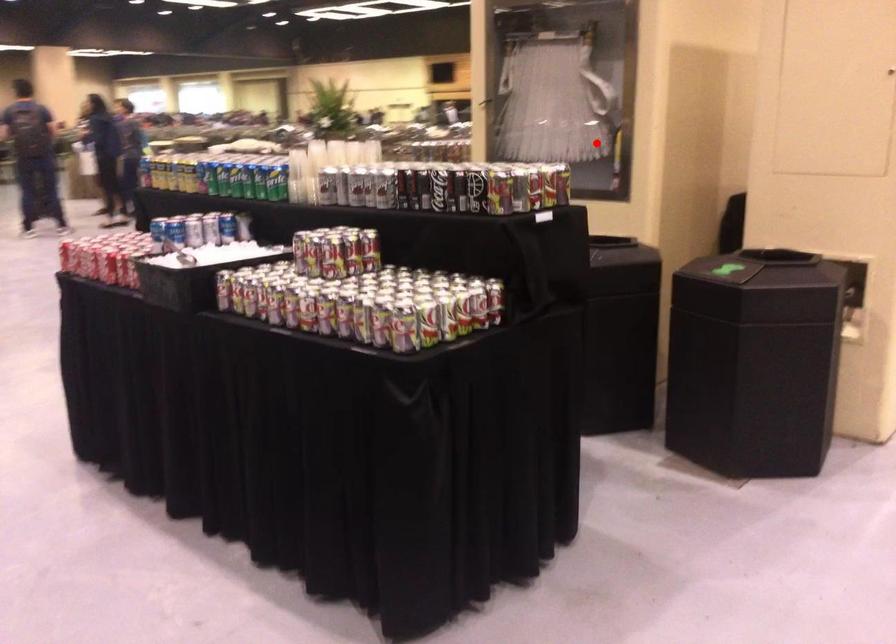
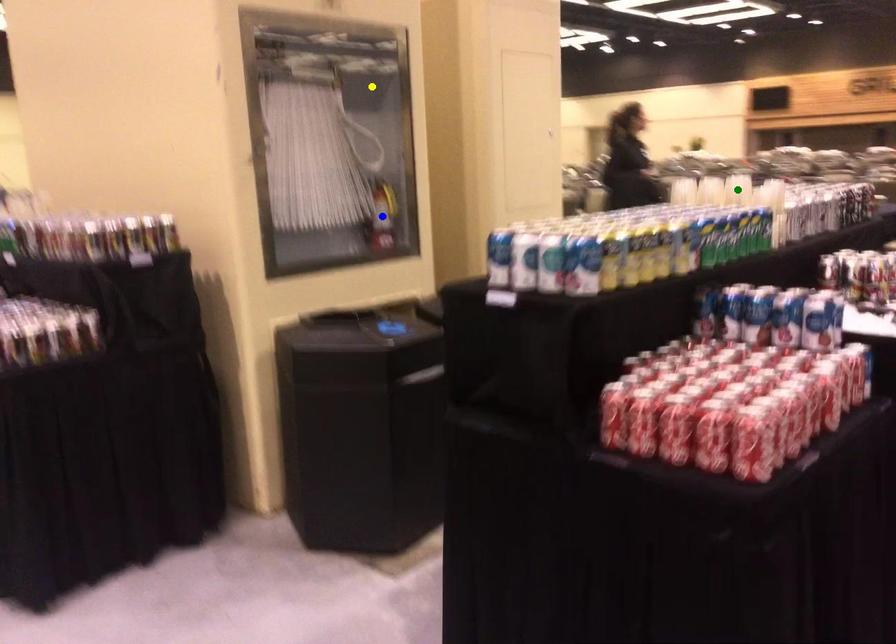
Question: I am providing you with two images of the same scene from different viewpoints. A red point is marked on the first image. You are given multiple points on the second image. Which spot in image 2 lines up with the point in image 1?

Choices:
 (A) green point
 (B) blue point
 (C) yellow point

Answer: (B)